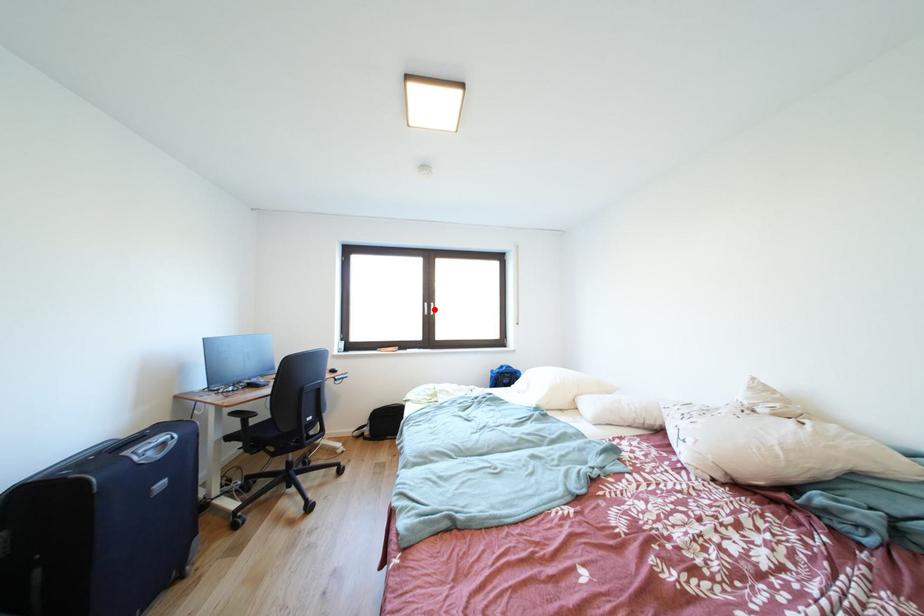
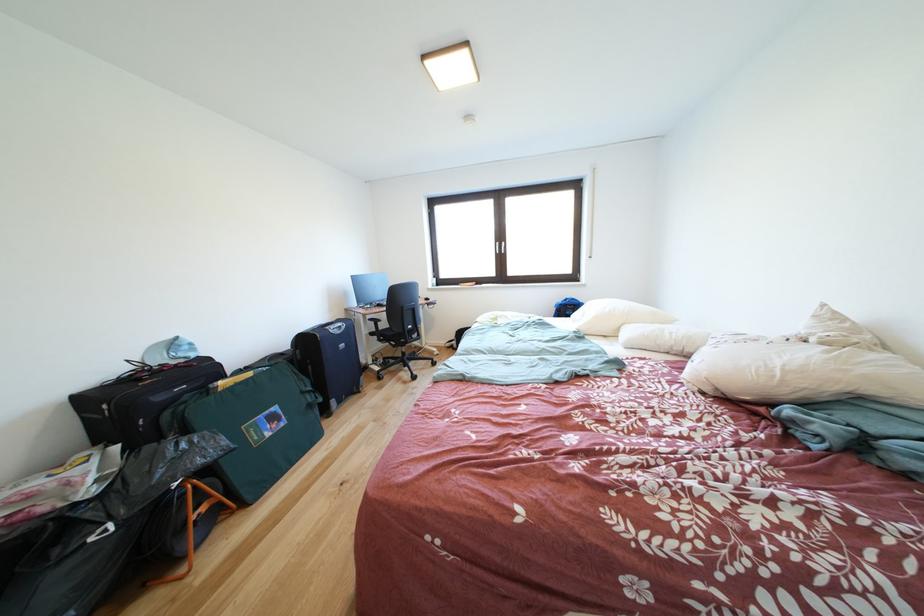
Locate, in the second image, the point that corresponds to the highlighted location in the first image.

(505, 249)